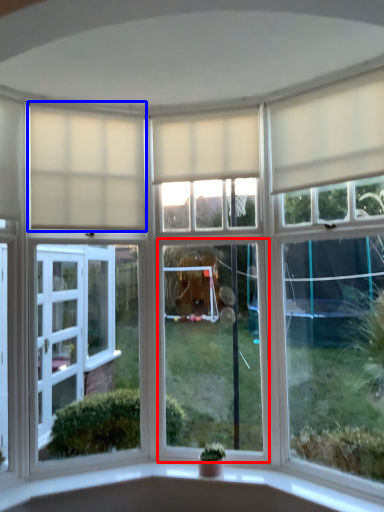
Question: Which object appears closest to the camera in this image, window (highlighted by a red box) or curtain (highlighted by a blue box)?

Choices:
 (A) window
 (B) curtain

Answer: (B)